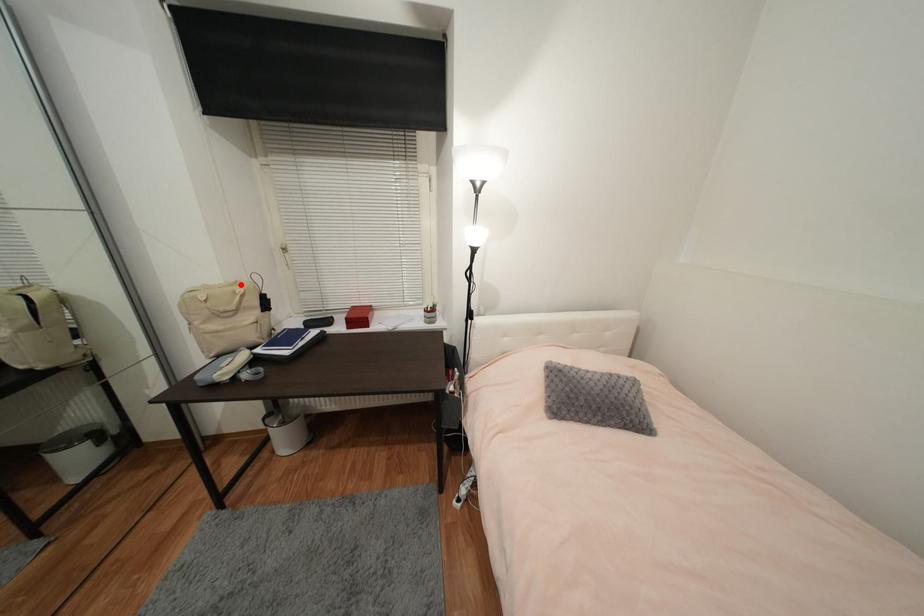
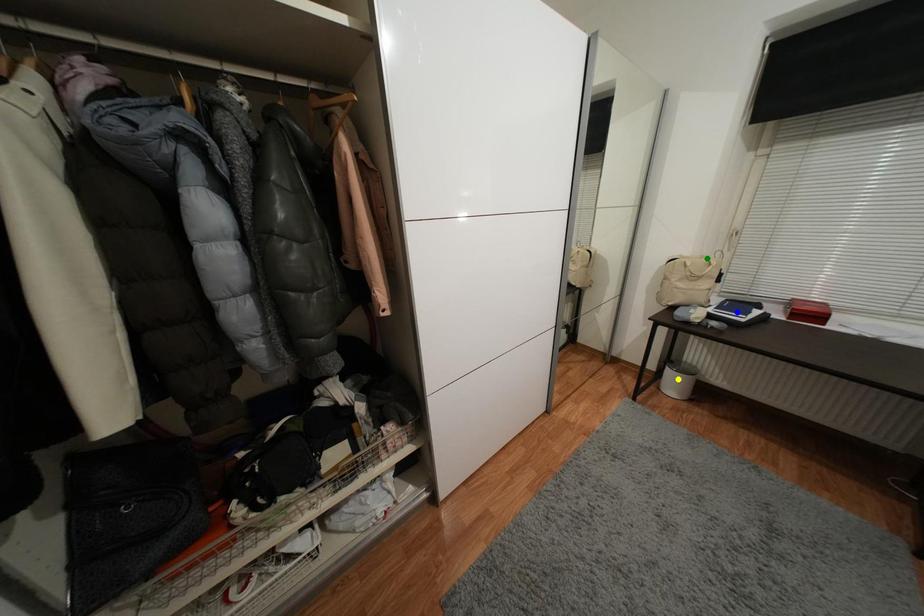
Question: I am providing you with two images of the same scene from different viewpoints. A red point is marked on the first image. You are given multiple points on the second image. Which spot in image 2 lines up with the point in image 1?

Choices:
 (A) green point
 (B) blue point
 (C) yellow point

Answer: (A)